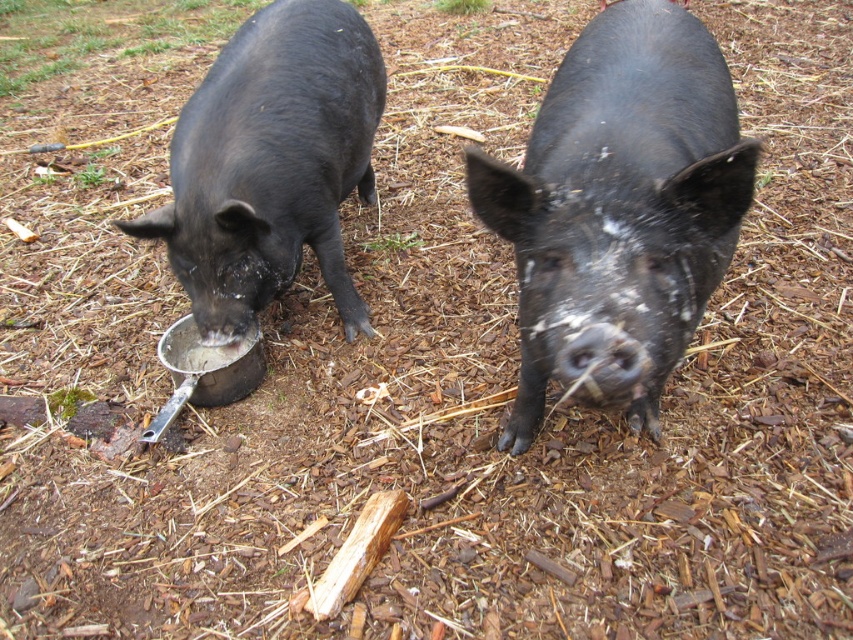
You are a farmer who wants to separate the black matte pig at center and the shiny black pig at center into two separate pens. The minimum distance required between the pigs in each pen is 36 inches. Can you place them in the same pen or do they need separate pens?

The black matte pig at center and shiny black pig at center are 36.49 inches apart from each other. Since the minimum required distance is 36 inches, they are just barely meeting the requirement. Therefore, they can be placed in the same pen as long as the distance is maintained.

You are standing in the image and want to pick up the shiny black pig at center. Which direction should you look to find it relative to the black matte pig at center?

The shiny black pig at center is above the black matte pig at center, so you should look upwards from the black matte pig at center to find it.

You are a farmer who wants to feed both pigs equally. Given that the black matte pig at center is larger than the shiny black pig at center, how should you adjust the amount of food in their bowls?

Since the black matte pig at center is larger than the shiny black pig at center, you should provide a larger portion of food for the black matte pig at center and a smaller portion for the shiny black pig at center to ensure equal feeding.